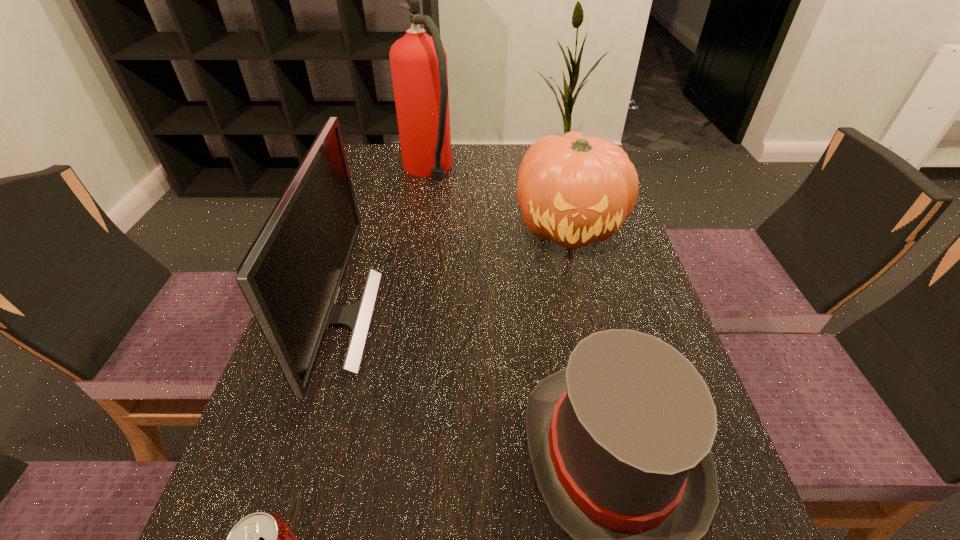
Locate an element on the screen. the tallest object is located at coordinates (418, 62).

This screenshot has width=960, height=540. I want to click on the fourth shortest object, so click(x=291, y=276).

Identify the location of the third shortest object. (574, 190).

Identify the location of free space located on the screen side of the monitor. The height and width of the screenshot is (540, 960). (421, 319).

At what (x,y) coordinates should I click in order to perform the action: click on vacant area situated 0.170m on the carved face of the third tallest object. Please return your answer as a coordinate pair (x, y). This screenshot has width=960, height=540. Looking at the image, I should click on (592, 321).

Where is `object positioned at the far edge`? object positioned at the far edge is located at coordinates (418, 62).

This screenshot has width=960, height=540. What are the coordinates of `fire extinguisher present at the left edge` in the screenshot? It's located at 418,62.

Where is `monitor at the left edge`? The height and width of the screenshot is (540, 960). monitor at the left edge is located at coordinates (291, 276).

Locate an element on the screen. object that is at the right edge is located at coordinates (574, 190).

This screenshot has height=540, width=960. Identify the location of object at the far left corner. (418, 62).